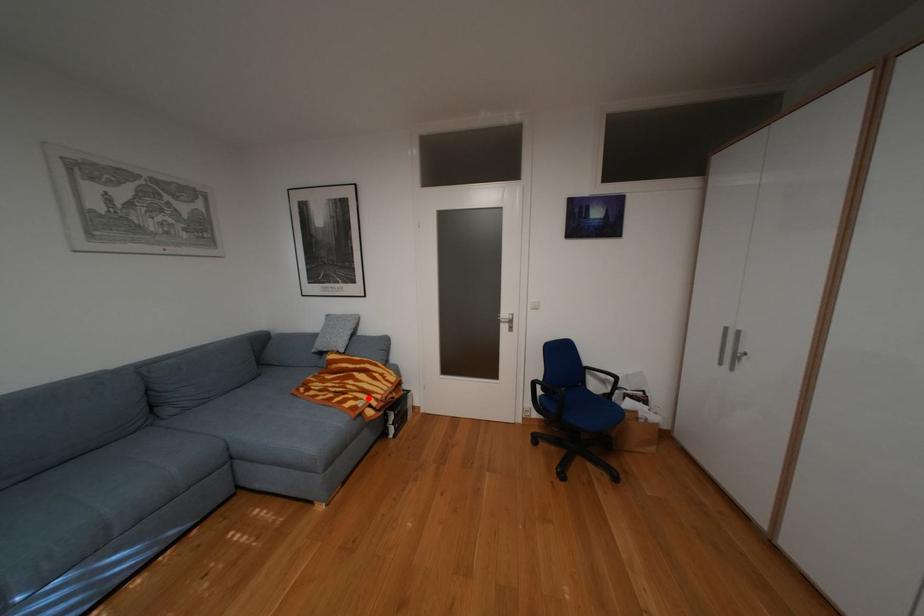
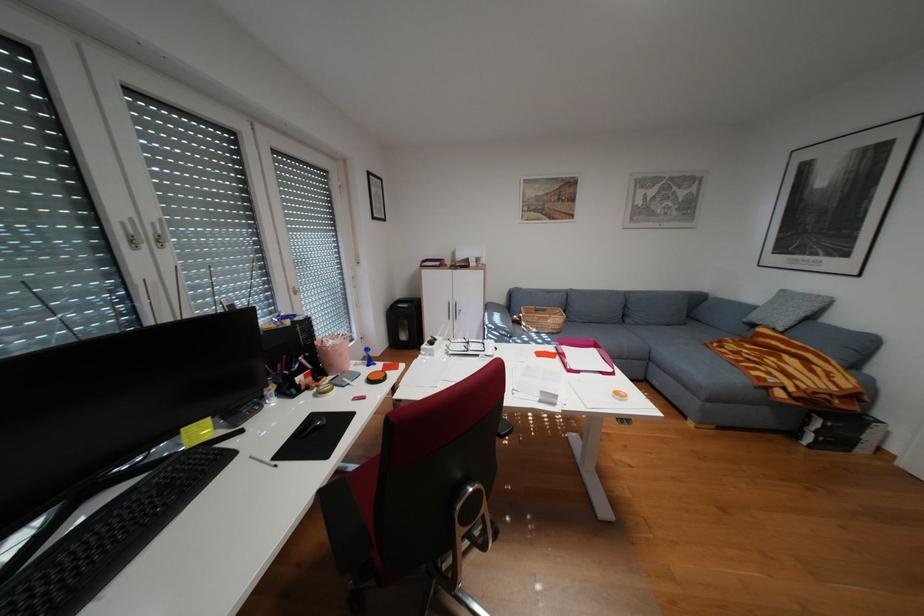
Question: I am providing you with two images of the same scene from different viewpoints. A red point is marked on the first image. At the location where the point appears in image 1, is it still visible in image 2?

Choices:
 (A) Yes
 (B) No

Answer: (A)